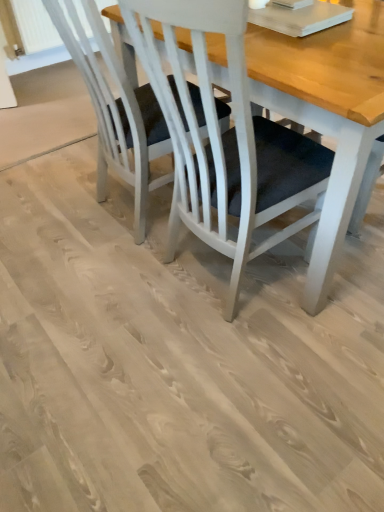
Locate an element on the screen. vacant area in front of white painted wood chair at center is located at coordinates (102, 294).